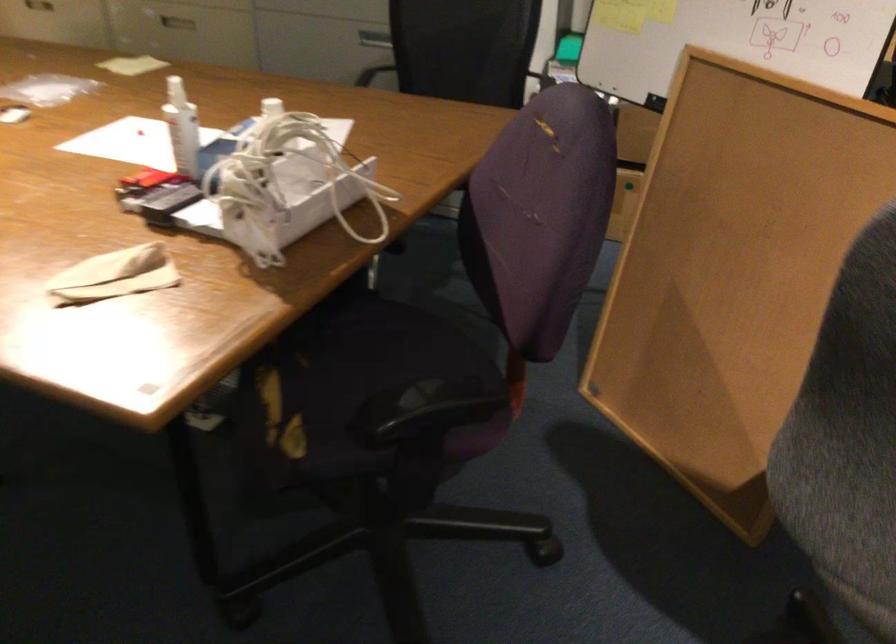
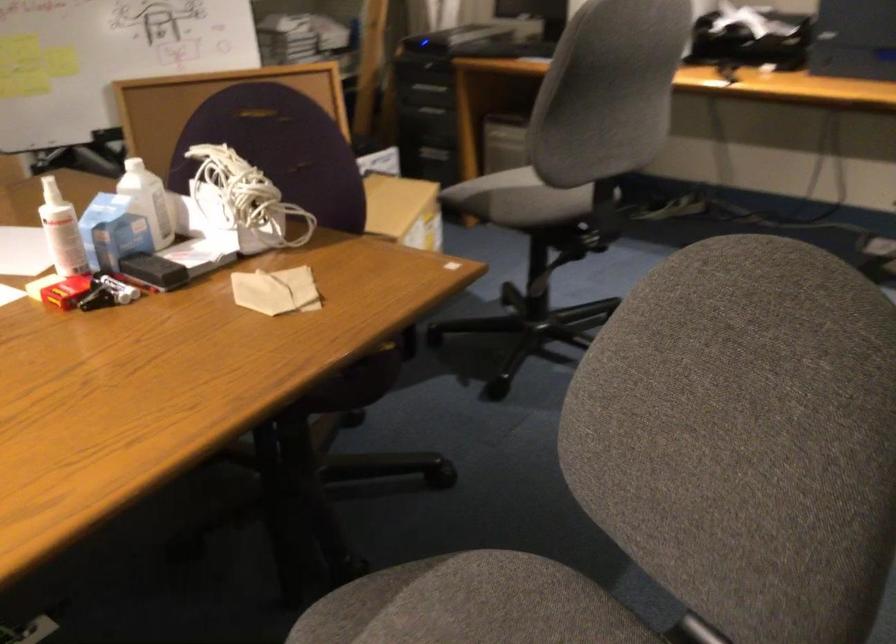
In the second image, find the point that corresponds to [165,200] in the first image.

(152, 270)